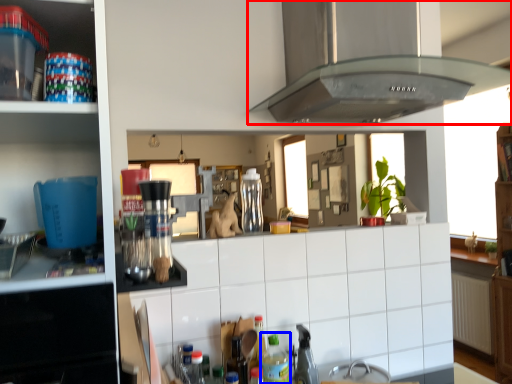
Question: Which point is closer to the camera, home appliance (highlighted by a red box) or bottle (highlighted by a blue box)?

Choices:
 (A) home appliance
 (B) bottle

Answer: (A)